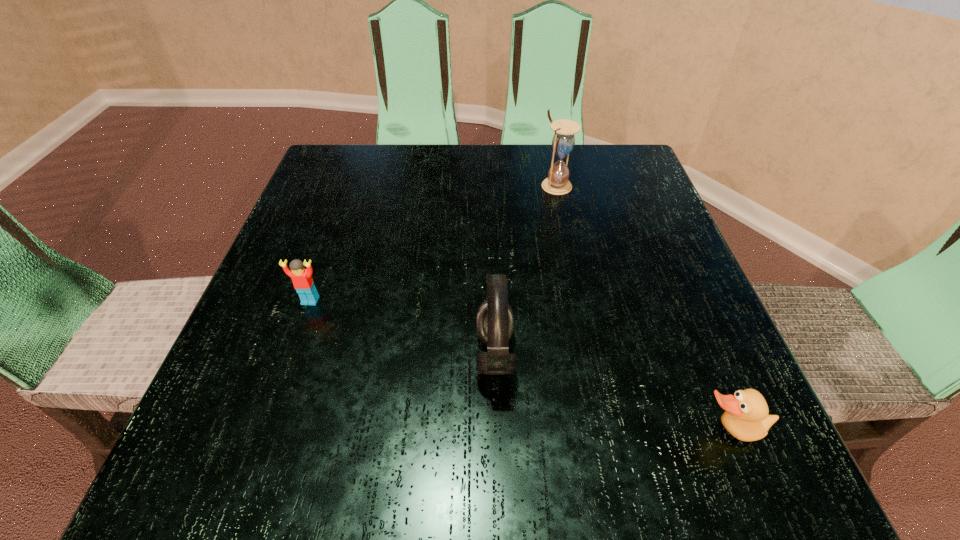
This screenshot has width=960, height=540. In order to click on free spot located on the earcups of the third farthest object in this screenshot , I will do `click(287, 355)`.

The image size is (960, 540). I want to click on vacant space located on the earcups of the third farthest object, so click(x=241, y=355).

The width and height of the screenshot is (960, 540). Find the location of `vacant area situated 0.200m on the face of the leftmost object`. vacant area situated 0.200m on the face of the leftmost object is located at coordinates (270, 417).

Find the location of a particular element. free location located 0.050m on the beak of the nearest object is located at coordinates (752, 486).

The height and width of the screenshot is (540, 960). In order to click on object situated at the far edge in this screenshot , I will do [x=563, y=141].

Locate an element on the screen. The width and height of the screenshot is (960, 540). object positioned at the near edge is located at coordinates (746, 417).

At what (x,y) coordinates should I click in order to perform the action: click on object situated at the left edge. Please return your answer as a coordinate pair (x, y). This screenshot has width=960, height=540. Looking at the image, I should click on (302, 279).

This screenshot has height=540, width=960. In order to click on object that is positioned at the right edge in this screenshot , I will do `click(746, 417)`.

Where is `object that is at the near right corner`? object that is at the near right corner is located at coordinates (746, 417).

Locate an element on the screen. This screenshot has width=960, height=540. free spot at the far edge of the desktop is located at coordinates (436, 200).